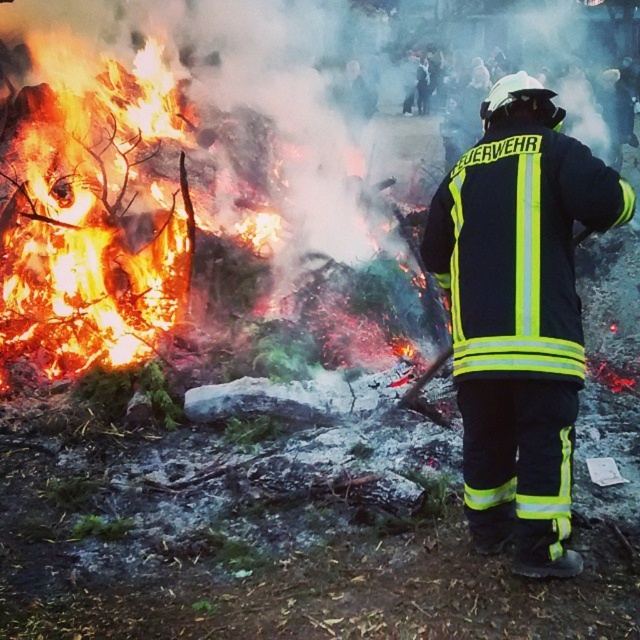
Image resolution: width=640 pixels, height=640 pixels. In order to click on flaming wood at left in this screenshot , I will do `click(166, 173)`.

Does flaming wood at left have a smaller size compared to reflective yellow-green uniform at center?

Yes.

Measure the distance between flaming wood at left and camera.

They are 6.02 meters apart.

Identify the location of flaming wood at left. (166, 173).